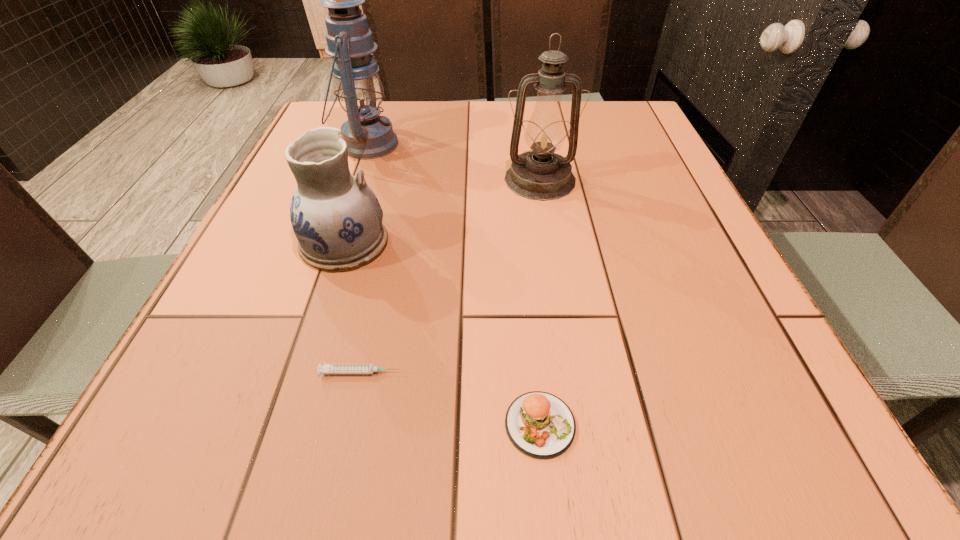
Identify the location of lantern. The height and width of the screenshot is (540, 960). (360, 92).

You are a GUI agent. You are given a task and a screenshot of the screen. Output one action in this format:
    pyautogui.click(x=<x>, y=<y>)
    Task: Click on the oil lamp
    This screenshot has width=960, height=540.
    Given the screenshot: What is the action you would take?
    pyautogui.click(x=540, y=174)

This screenshot has height=540, width=960. I want to click on the third tallest object, so click(337, 219).

What are the coordinates of `pottery` in the screenshot? It's located at coord(337,219).

Locate an element on the screen. patty is located at coordinates (539, 424).

In order to click on the nearest object in this screenshot , I will do `click(539, 424)`.

Find the location of a particular element. This screenshot has width=960, height=540. the second nearest object is located at coordinates (326, 368).

At what (x,y) coordinates should I click in order to perform the action: click on the shortest object. Please return your answer as a coordinate pair (x, y). This screenshot has height=540, width=960. Looking at the image, I should click on (326, 368).

At what (x,y) coordinates should I click in order to perform the action: click on free space located on the front-facing side of the lantern. Please return your answer as a coordinate pair (x, y). Looking at the image, I should click on (421, 145).

Locate an element on the screen. The width and height of the screenshot is (960, 540). vacant space situated 0.050m on the back of the oil lamp is located at coordinates (535, 150).